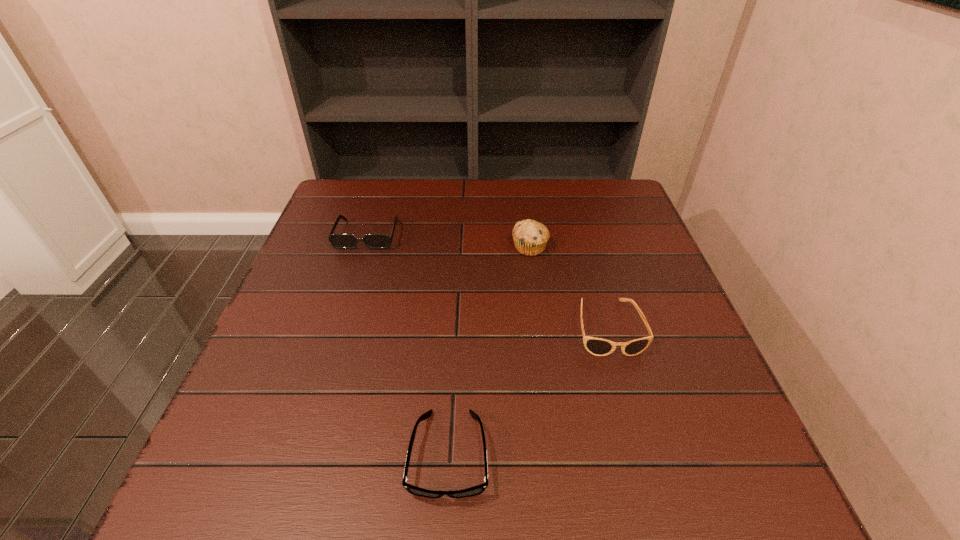
In the image, there is a desktop. At what (x,y) coordinates should I click in order to perform the action: click on vacant space at the near left corner. Please return your answer as a coordinate pair (x, y). The width and height of the screenshot is (960, 540). Looking at the image, I should click on (270, 502).

This screenshot has height=540, width=960. In order to click on unoccupied area between the rightmost object and the tallest object in this screenshot , I will do `click(568, 287)`.

Locate an element on the screen. free space between the leftmost sunglasses and the nearest sunglasses is located at coordinates (408, 345).

This screenshot has width=960, height=540. Identify the location of vacant space in between the tallest object and the leftmost object. (448, 241).

Where is `free space between the rightmost object and the third object from left to right`? The image size is (960, 540). free space between the rightmost object and the third object from left to right is located at coordinates (568, 287).

I want to click on free space between the farthest sunglasses and the muffin, so click(x=448, y=241).

The width and height of the screenshot is (960, 540). What are the coordinates of `vacant space that is in between the second nearest sunglasses and the muffin` in the screenshot? It's located at [x=568, y=287].

The image size is (960, 540). Find the location of `empty space that is in between the tallest object and the nearest sunglasses`. empty space that is in between the tallest object and the nearest sunglasses is located at coordinates (490, 350).

This screenshot has width=960, height=540. I want to click on free space between the leftmost object and the second sunglasses from right to left, so click(408, 345).

Find the location of a particular element. vacant space that is in between the second nearest sunglasses and the leftmost object is located at coordinates (488, 281).